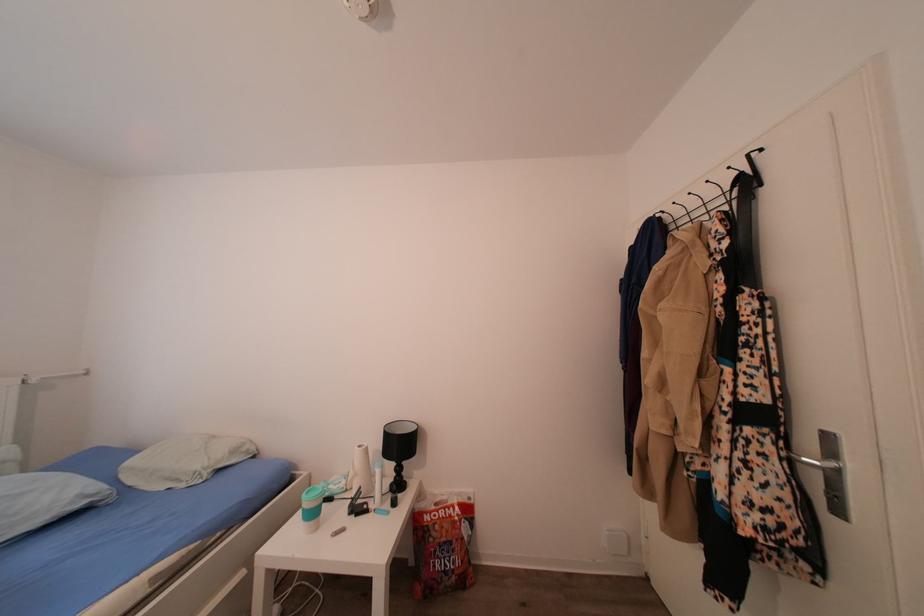
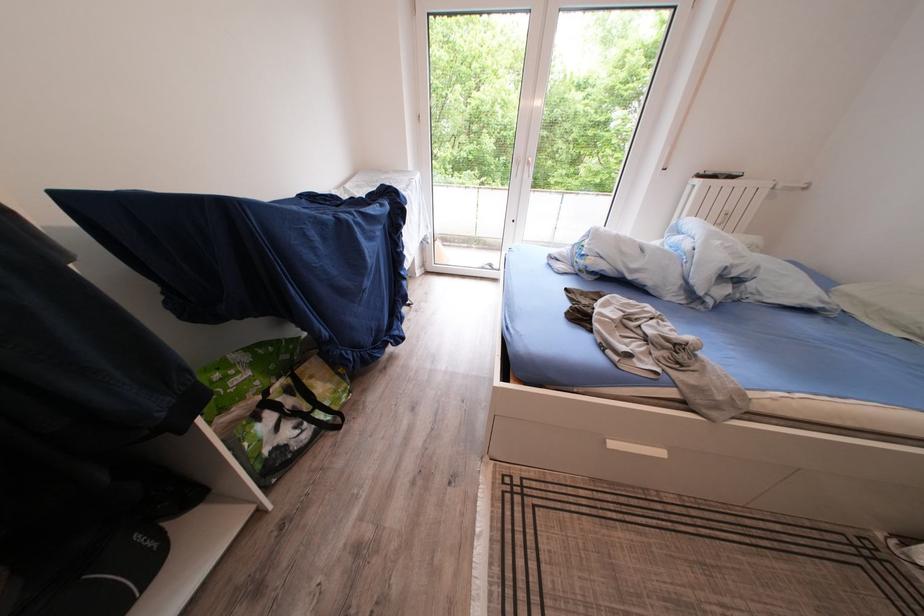
Based on the photo, the first image is from the beginning of the video and the second image is from the end. How did the camera likely rotate when shooting the video?

The camera's rotation is toward left-down.